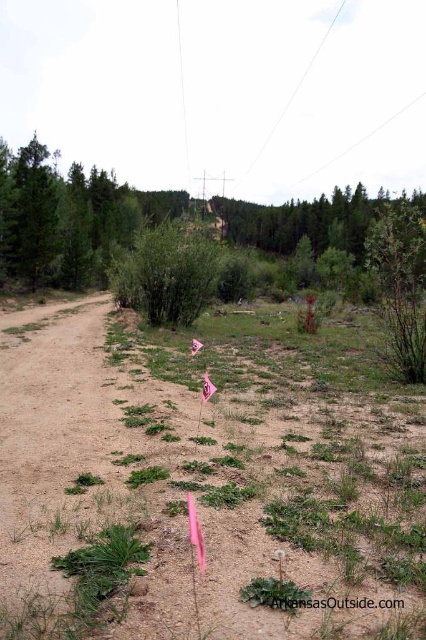
You are standing at the starting point of the dirt path in the rural scene. You notice two points marked on the path. Which point is closer to you, point (x=97, y=636) or point (x=192, y=268)?

Point (x=97, y=636) is closer to the viewer than point (x=192, y=268).